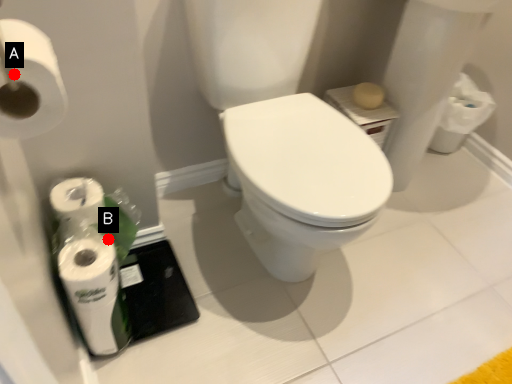
Question: Two points are circled on the image, labeled by A and B beside each circle. Which of the following is the closest to the observer?

Choices:
 (A) A is closer
 (B) B is closer

Answer: (A)